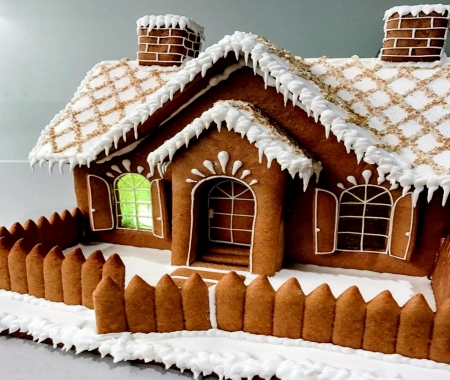
This screenshot has height=380, width=450. I want to click on archway, so click(228, 143).